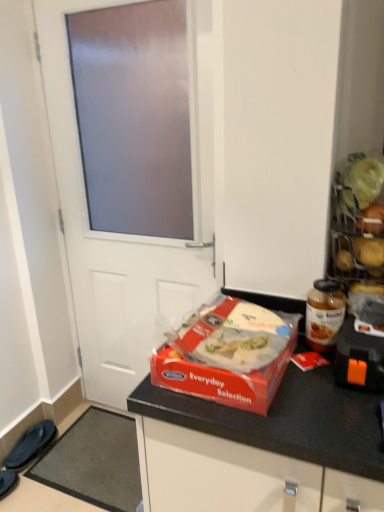
Identify the location of vacant space situated above gray carpet at lower left (from a real-world perspective). This screenshot has height=512, width=384. (97, 453).